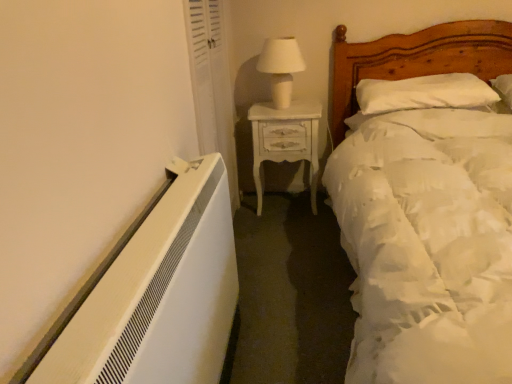
Question: Is white glossy nightstand at center completely or partially outside of white soft pillow at upper right?

Choices:
 (A) yes
 (B) no

Answer: (A)

Question: From the image's perspective, is white glossy nightstand at center on top of white soft pillow at upper right?

Choices:
 (A) yes
 (B) no

Answer: (B)

Question: Is white soft pillow at upper right completely or partially inside white glossy nightstand at center?

Choices:
 (A) no
 (B) yes

Answer: (A)

Question: Considering the relative sizes of white glossy nightstand at center and white soft pillow at upper right in the image provided, is white glossy nightstand at center wider than white soft pillow at upper right?

Choices:
 (A) no
 (B) yes

Answer: (A)

Question: From a real-world perspective, does white glossy nightstand at center stand above white soft pillow at upper right?

Choices:
 (A) no
 (B) yes

Answer: (A)

Question: Is white glossy nightstand at center taller than white soft pillow at upper right?

Choices:
 (A) no
 (B) yes

Answer: (B)

Question: Can we say white soft bed at right lies outside white ceramic table lamp at upper center?

Choices:
 (A) no
 (B) yes

Answer: (B)

Question: Is white soft bed at right bigger than white ceramic table lamp at upper center?

Choices:
 (A) no
 (B) yes

Answer: (B)

Question: Considering the relative sizes of white soft bed at right and white ceramic table lamp at upper center in the image provided, is white soft bed at right thinner than white ceramic table lamp at upper center?

Choices:
 (A) no
 (B) yes

Answer: (A)

Question: Is white soft bed at right oriented towards white ceramic table lamp at upper center?

Choices:
 (A) no
 (B) yes

Answer: (A)

Question: Is white soft bed at right at the right side of white ceramic table lamp at upper center?

Choices:
 (A) yes
 (B) no

Answer: (A)

Question: Considering the relative sizes of white soft bed at right and white ceramic table lamp at upper center in the image provided, is white soft bed at right wider than white ceramic table lamp at upper center?

Choices:
 (A) yes
 (B) no

Answer: (A)

Question: From a real-world perspective, is white soft pillow at upper right under white soft bed at right?

Choices:
 (A) yes
 (B) no

Answer: (B)